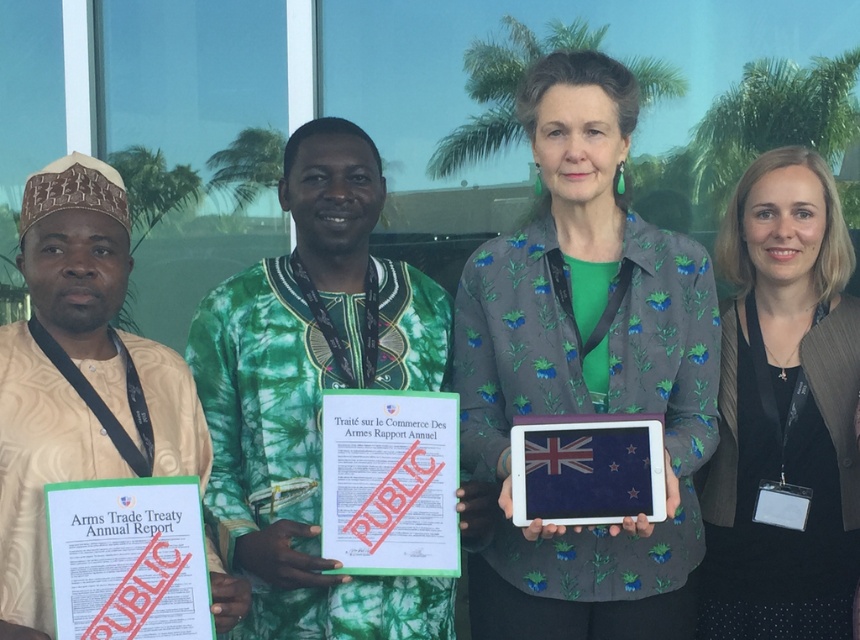
Who is taller, beige fabric shirt at left or green paper document at center?

beige fabric shirt at left

Is beige fabric shirt at left bigger than green paper document at center?

Correct, beige fabric shirt at left is larger in size than green paper document at center.

This screenshot has width=860, height=640. What do you see at coordinates (78, 376) in the screenshot? I see `beige fabric shirt at left` at bounding box center [78, 376].

Locate an element on the screen. beige fabric shirt at left is located at coordinates (78, 376).

Can you confirm if black matte jacket at right is shorter than green paper document at center?

No, black matte jacket at right is not shorter than green paper document at center.

Does point (719, 444) come in front of point (384, 429)?

No, (719, 444) is behind (384, 429).

Locate an element on the screen. black matte jacket at right is located at coordinates (783, 410).

Which of these two, green paper document at center or green paper document at lower left, stands taller?

With more height is green paper document at center.

Is point (422, 404) positioned before point (175, 600)?

No, it is behind (175, 600).

What do you see at coordinates (390, 481) in the screenshot?
I see `green paper document at center` at bounding box center [390, 481].

At what (x,y) coordinates should I click in order to perform the action: click on green paper document at center. Please return your answer as a coordinate pair (x, y). This screenshot has width=860, height=640. Looking at the image, I should click on (390, 481).